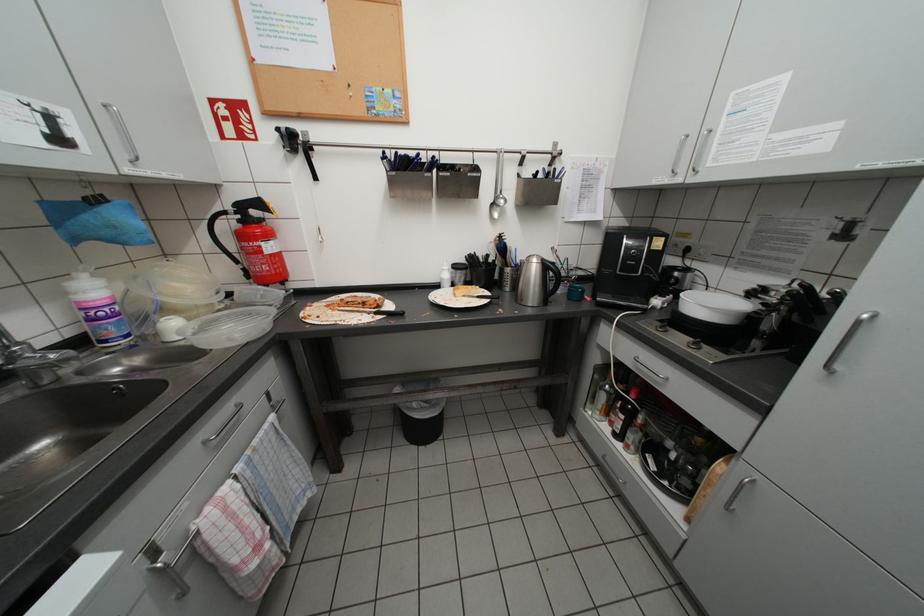
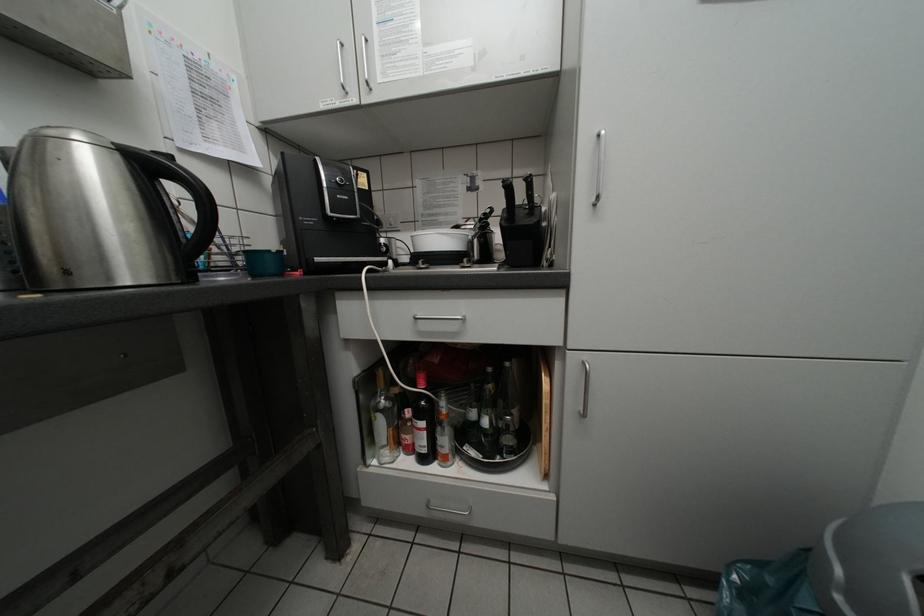
Question: The camera is either moving clockwise (left) or counter-clockwise (right) around the object. The first image is from the beginning of the video and the second image is from the end. Is the camera moving left or right when shooting the video?

Choices:
 (A) Left
 (B) Right

Answer: (A)